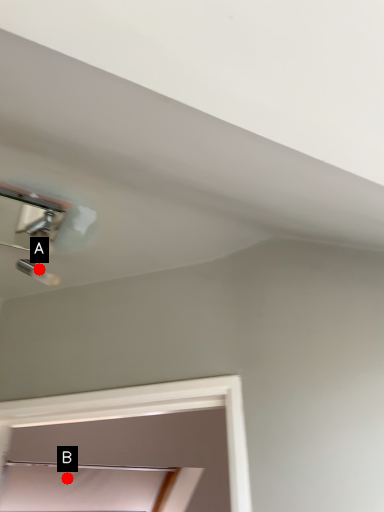
Question: Two points are circled on the image, labeled by A and B beside each circle. Which of the following is the farthest from the observer?

Choices:
 (A) A is further
 (B) B is further

Answer: (B)